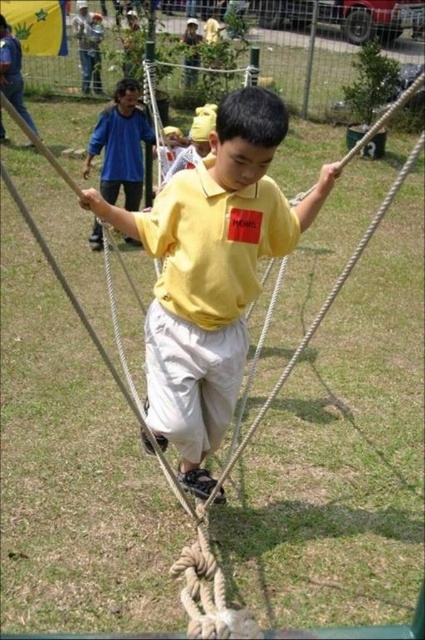
Based on the scene description, where is the yellow matte shirt at center located in terms of coordinates?

The yellow matte shirt at center is located at point coordinates of 0.427 on the x axis and 0.499 on the y axis.